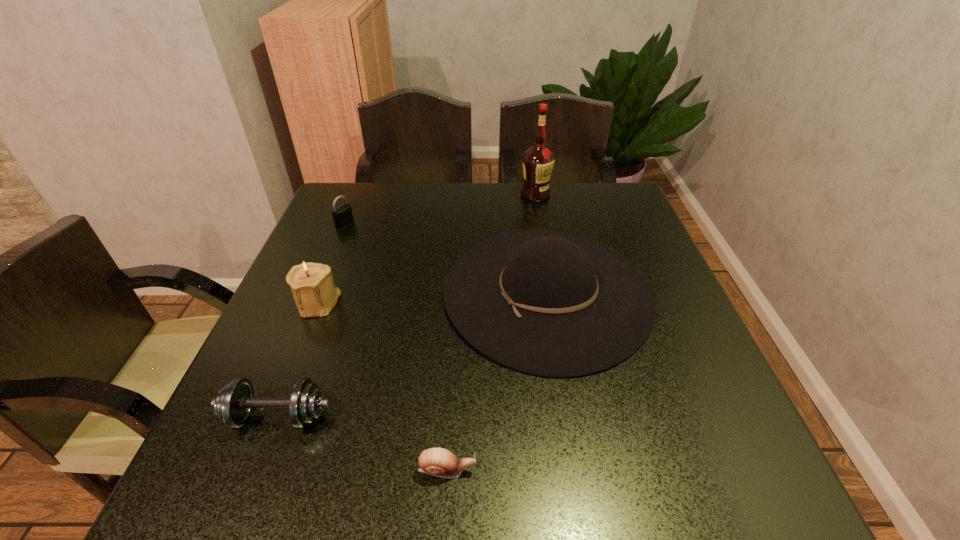
The height and width of the screenshot is (540, 960). What are the coordinates of `free spot between the candle_holder and the tallest object` in the screenshot? It's located at click(x=426, y=249).

Find the location of a particular element. The width and height of the screenshot is (960, 540). vacant space that is in between the fifth farthest object and the sombrero is located at coordinates (413, 354).

Where is `unoccupied area between the padlock and the alcohol`? unoccupied area between the padlock and the alcohol is located at coordinates 440,209.

The height and width of the screenshot is (540, 960). I want to click on unoccupied area between the sombrero and the dumbbell, so click(413, 354).

This screenshot has width=960, height=540. I want to click on free space between the dumbbell and the second farthest object, so (x=311, y=320).

Where is `vacant area between the shortest object and the candle_holder`? Image resolution: width=960 pixels, height=540 pixels. vacant area between the shortest object and the candle_holder is located at coordinates [382, 386].

Identify the location of object identified as the closest to the candle_holder. (233, 404).

Identify which object is the fourth nearest to the candle_holder. Please provide its 2D coordinates. Your answer should be formatted as a tuple, i.e. [(x, y)], where the tuple contains the x and y coordinates of a point satisfying the conditions above.

[(436, 461)]

Identify the location of vacant region that satisfies the following two spatial constraints: 1. on the label of the alcohol; 2. on the front-facing side of the sombrero. The width and height of the screenshot is (960, 540). (553, 293).

This screenshot has height=540, width=960. Identify the location of free space in the image that satisfies the following two spatial constraints: 1. on the label of the farthest object; 2. on the front-facing side of the sombrero. (553, 293).